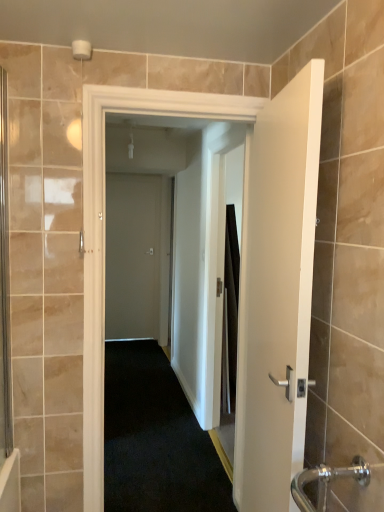
Question: Considering the positions of white matte door at center, which is counted as the second door, starting from the right, and clear glass screen door at left, acting as the first screen door starting from the left, in the image, is white matte door at center, which is counted as the second door, starting from the right, wider or thinner than clear glass screen door at left, acting as the first screen door starting from the left,?

Choices:
 (A) wide
 (B) thin

Answer: (A)

Question: Which is correct: white matte door at center, which is the second door in left-to-right order, is inside clear glass screen door at left, placed as the 2th screen door when sorted from right to left, or outside of it?

Choices:
 (A) inside
 (B) outside

Answer: (B)

Question: Based on their relative distances, which object is farther from the white matte door at center, which is the second door in left-to-right order?

Choices:
 (A) matte gray door at center, the 3th door from the front
 (B) clear glass screen door at left, the second screen door from the back
 (C) transparent glass screen door at center, which is the 1th screen door from back to front
 (D) white matte door at center, the third door from the back

Answer: (B)

Question: Estimate the real-world distances between objects in this image. Which object is farther from the transparent glass screen door at center, which appears as the second screen door when viewed from the front?

Choices:
 (A) clear glass screen door at left, the first screen door viewed from the front
 (B) white matte door at center, the 3th door viewed from the left
 (C) white matte door at center, which is the second door in left-to-right order
 (D) matte gray door at center, which is the 1th door in left-to-right order

Answer: (D)